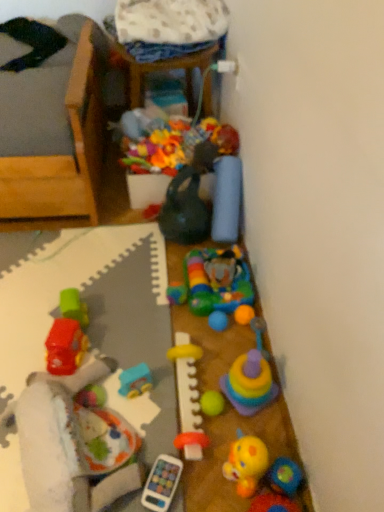
Image resolution: width=384 pixels, height=512 pixels. Describe the element at coordinates (214, 282) in the screenshot. I see `rubberized plastic elephant at center, the 6th toy when ordered from left to right` at that location.

This screenshot has width=384, height=512. Describe the element at coordinates (188, 397) in the screenshot. I see `yellow rubber teething ring at center, the 4th toy from the left` at that location.

Measure the distance between point (48, 432) and camera.

Point (48, 432) and camera are 38.74 inches apart.

The height and width of the screenshot is (512, 384). What do you see at coordinates (246, 463) in the screenshot? I see `rubber duck at center, the fifth toy from the right` at bounding box center [246, 463].

What do you see at coordinates (227, 200) in the screenshot? I see `blue fabric pillow at upper right, arranged as the 4th toy when viewed from the right` at bounding box center [227, 200].

This screenshot has width=384, height=512. Identify the location of green rubber ball at center, which appears as the 5th toy when viewed from the left. (212, 403).

Locate an element on the screen. This screenshot has height=512, width=384. matte green kettle at center, the 3th toy from the left is located at coordinates (185, 210).

Is rubberized plastic elephant at center, the 6th toy when ordered from left to right, to the left or to the right of yellow rubber teething ring at center, positioned as the eighth toy in right-to-left order, in the image?

Clearly, rubberized plastic elephant at center, the 6th toy when ordered from left to right, is on the right of yellow rubber teething ring at center, positioned as the eighth toy in right-to-left order, in the image.

From a real-world perspective, is rubberized plastic elephant at center, marked as the 6th toy in a right-to-left arrangement, on top of yellow rubber teething ring at center, positioned as the eighth toy in right-to-left order?

No, from a real-world perspective, rubberized plastic elephant at center, marked as the 6th toy in a right-to-left arrangement, is not on top of yellow rubber teething ring at center, positioned as the eighth toy in right-to-left order.

Can we say rubberized plastic elephant at center, marked as the 6th toy in a right-to-left arrangement, lies outside yellow rubber teething ring at center, the 4th toy from the left?

Indeed, rubberized plastic elephant at center, marked as the 6th toy in a right-to-left arrangement, is completely outside yellow rubber teething ring at center, the 4th toy from the left.

Considering the sizes of objects rubberized plastic elephant at center, marked as the 6th toy in a right-to-left arrangement, and yellow rubber teething ring at center, positioned as the eighth toy in right-to-left order, in the image provided, who is taller, rubberized plastic elephant at center, marked as the 6th toy in a right-to-left arrangement, or yellow rubber teething ring at center, positioned as the eighth toy in right-to-left order,?

Standing taller between the two is yellow rubber teething ring at center, positioned as the eighth toy in right-to-left order.

Between rubberized plastic elephant at center, marked as the 6th toy in a right-to-left arrangement, and orange rubber ball at center-right, the 10th toy from the left, which one has less height?

Standing shorter between the two is orange rubber ball at center-right, the 10th toy from the left.

Can you confirm if rubberized plastic elephant at center, the 6th toy when ordered from left to right, is bigger than orange rubber ball at center-right, marked as the second toy in a right-to-left arrangement?

Yes.

Considering the relative sizes of rubberized plastic elephant at center, the 6th toy when ordered from left to right, and orange rubber ball at center-right, marked as the second toy in a right-to-left arrangement, in the image provided, is rubberized plastic elephant at center, the 6th toy when ordered from left to right, wider than orange rubber ball at center-right, marked as the second toy in a right-to-left arrangement,?

Yes, rubberized plastic elephant at center, the 6th toy when ordered from left to right, is wider than orange rubber ball at center-right, marked as the second toy in a right-to-left arrangement.

Is wooden toy box at upper center taller or shorter than rubberized plastic baby rattle at lower left, the 11th toy when ordered from right to left?

wooden toy box at upper center is taller than rubberized plastic baby rattle at lower left, the 11th toy when ordered from right to left.

Considering the sizes of objects wooden toy box at upper center and rubberized plastic baby rattle at lower left, arranged as the first toy when viewed from the left, in the image provided, who is wider, wooden toy box at upper center or rubberized plastic baby rattle at lower left, arranged as the first toy when viewed from the left,?

Wider between the two is rubberized plastic baby rattle at lower left, arranged as the first toy when viewed from the left.

Is wooden toy box at upper center touching rubberized plastic baby rattle at lower left, the 11th toy when ordered from right to left?

They are not placed beside each other.

Considering the relative sizes of wooden toy box at upper center and rubberized plastic baby rattle at lower left, the 11th toy when ordered from right to left, in the image provided, is wooden toy box at upper center bigger than rubberized plastic baby rattle at lower left, the 11th toy when ordered from right to left,?

Correct, wooden toy box at upper center is larger in size than rubberized plastic baby rattle at lower left, the 11th toy when ordered from right to left.

How different are the orientations of rubberized plastic elephant at center, the 6th toy when ordered from left to right, and blue fabric pillow at upper right, arranged as the 4th toy when viewed from the right, in degrees?

rubberized plastic elephant at center, the 6th toy when ordered from left to right, and blue fabric pillow at upper right, arranged as the 4th toy when viewed from the right, are facing 5.91 degrees away from each other.

Is rubberized plastic elephant at center, marked as the 6th toy in a right-to-left arrangement, wider than blue fabric pillow at upper right, the 8th toy from the left?

Indeed, rubberized plastic elephant at center, marked as the 6th toy in a right-to-left arrangement, has a greater width compared to blue fabric pillow at upper right, the 8th toy from the left.

Identify the location of toy that is the 2nd one when counting forward from the blue fabric pillow at upper right, the 8th toy from the left. (214, 282).

Does rubberized plastic elephant at center, marked as the 6th toy in a right-to-left arrangement, have a larger size compared to blue fabric pillow at upper right, arranged as the 4th toy when viewed from the right?

Incorrect, rubberized plastic elephant at center, marked as the 6th toy in a right-to-left arrangement, is not larger than blue fabric pillow at upper right, arranged as the 4th toy when viewed from the right.

From a real-world perspective, between orange rubber ball at center-right, the 10th toy from the left, and rubberized plastic elephant at center, marked as the 6th toy in a right-to-left arrangement, who is vertically higher?

orange rubber ball at center-right, the 10th toy from the left, is physically above.

Visually, is orange rubber ball at center-right, marked as the second toy in a right-to-left arrangement, positioned to the left or to the right of rubberized plastic elephant at center, marked as the 6th toy in a right-to-left arrangement?

orange rubber ball at center-right, marked as the second toy in a right-to-left arrangement, is to the right of rubberized plastic elephant at center, marked as the 6th toy in a right-to-left arrangement.

Which object is more forward, orange rubber ball at center-right, marked as the second toy in a right-to-left arrangement, or rubberized plastic elephant at center, the 6th toy when ordered from left to right?

orange rubber ball at center-right, marked as the second toy in a right-to-left arrangement, is closer to the camera.

Can you confirm if orange rubber ball at center-right, marked as the second toy in a right-to-left arrangement, is bigger than rubberized plastic elephant at center, the 6th toy when ordered from left to right?

Incorrect, orange rubber ball at center-right, marked as the second toy in a right-to-left arrangement, is not larger than rubberized plastic elephant at center, the 6th toy when ordered from left to right.

Can you confirm if blue plastic toy car at center, positioned as the tenth toy in right-to-left order, is smaller than orange rubber ball at center-right, the 10th toy from the left?

Actually, blue plastic toy car at center, positioned as the tenth toy in right-to-left order, might be larger than orange rubber ball at center-right, the 10th toy from the left.

Which toy is the 1st one when counting from the front of the orange rubber ball at center-right, the 10th toy from the left? Please provide its 2D coordinates.

[(135, 381)]

Looking at their sizes, would you say blue plastic toy car at center, which is the second toy from left to right, is wider or thinner than orange rubber ball at center-right, the 10th toy from the left?

In the image, blue plastic toy car at center, which is the second toy from left to right, appears to be wider than orange rubber ball at center-right, the 10th toy from the left.

Does rubberized plastic baby rattle at lower left, arranged as the first toy when viewed from the left, have a lesser width compared to yellow rubber teething ring at center, positioned as the eighth toy in right-to-left order?

No, rubberized plastic baby rattle at lower left, arranged as the first toy when viewed from the left, is not thinner than yellow rubber teething ring at center, positioned as the eighth toy in right-to-left order.

Based on the photo, is rubberized plastic baby rattle at lower left, arranged as the first toy when viewed from the left, spatially inside yellow rubber teething ring at center, the 4th toy from the left, or outside of it?

The correct answer is: outside.

Considering the relative sizes of rubberized plastic baby rattle at lower left, arranged as the first toy when viewed from the left, and yellow rubber teething ring at center, positioned as the eighth toy in right-to-left order, in the image provided, is rubberized plastic baby rattle at lower left, arranged as the first toy when viewed from the left, taller than yellow rubber teething ring at center, positioned as the eighth toy in right-to-left order,?

Yes.

The height and width of the screenshot is (512, 384). I want to click on the 5th toy in front when counting from the rubberized plastic elephant at center, marked as the 6th toy in a right-to-left arrangement, so click(188, 397).

Find the location of a particular element. This screenshot has width=384, height=512. toy that is the 4th object to the left of the orange rubber ball at center-right, marked as the second toy in a right-to-left arrangement, starting at the anchor is located at coordinates (214, 282).

Estimate the real-world distances between objects in this image. Which object is closer to orange rubber ball at center-right, the 10th toy from the left, rubberized plastic stacking cups at center-right, which is counted as the 3th toy, starting from the right, or rubberized plastic baby rattle at lower left, the 11th toy when ordered from right to left?

rubberized plastic stacking cups at center-right, which is counted as the 3th toy, starting from the right.

Which object lies nearer to the anchor point yellow rubber teething ring at center, the 4th toy from the left, blue plastic toy car at center, positioned as the tenth toy in right-to-left order, or green rubber ball at center, which appears as the 5th toy when viewed from the left?

green rubber ball at center, which appears as the 5th toy when viewed from the left.

When comparing their distances from rubberized plastic elephant at center, the 6th toy when ordered from left to right, does yellow rubber teething ring at center, the 4th toy from the left, or green rubber ball at center, which appears as the 5th toy when viewed from the left, seem closer?

yellow rubber teething ring at center, the 4th toy from the left, is closer to rubberized plastic elephant at center, the 6th toy when ordered from left to right.

Looking at the image, which one is located further to rubberized yellow duck at lower right, which is the eleventh toy from left to right, rubberized plastic elephant at center, marked as the 6th toy in a right-to-left arrangement, or green rubber ball at center, which is counted as the 7th toy, starting from the right?

rubberized plastic elephant at center, marked as the 6th toy in a right-to-left arrangement, is positioned further to the anchor rubberized yellow duck at lower right, which is the eleventh toy from left to right.

Looking at the image, which one is located further to blue fabric pillow at upper right, the 8th toy from the left, rubber duck at center, which is the 7th toy in left-to-right order, or orange rubber ball at center-right, the 10th toy from the left?

Among the two, rubber duck at center, which is the 7th toy in left-to-right order, is located further to blue fabric pillow at upper right, the 8th toy from the left.

Based on the photo, which object lies further to the anchor point rubberized plastic elephant at center, the 6th toy when ordered from left to right, rubber duck at center, which is the 7th toy in left-to-right order, or blue plastic toy car at center, positioned as the tenth toy in right-to-left order?

Among the two, rubber duck at center, which is the 7th toy in left-to-right order, is located further to rubberized plastic elephant at center, the 6th toy when ordered from left to right.

Based on their spatial positions, is orange rubber ball at center-right, the 10th toy from the left, or rubberized plastic elephant at center, marked as the 6th toy in a right-to-left arrangement, further from matte green kettle at center, marked as the ninth toy in a right-to-left arrangement?

orange rubber ball at center-right, the 10th toy from the left, is positioned further to the anchor matte green kettle at center, marked as the ninth toy in a right-to-left arrangement.

When comparing their distances from yellow rubber teething ring at center, positioned as the eighth toy in right-to-left order, does rubberized yellow duck at lower right, which is the eleventh toy from left to right, or rubberized plastic baby rattle at lower left, arranged as the first toy when viewed from the left, seem closer?

rubberized plastic baby rattle at lower left, arranged as the first toy when viewed from the left, lies closer to yellow rubber teething ring at center, positioned as the eighth toy in right-to-left order, than the other object.

Find the location of a particular element. The height and width of the screenshot is (512, 384). toy between blue fabric pillow at upper right, the 8th toy from the left, and rubberized plastic elephant at center, marked as the 6th toy in a right-to-left arrangement, vertically is located at coordinates (185, 210).

Image resolution: width=384 pixels, height=512 pixels. Identify the location of toy between wooden toy box at upper center and matte green kettle at center, marked as the ninth toy in a right-to-left arrangement, from top to bottom. (227, 200).

Locate an element on the screen. Image resolution: width=384 pixels, height=512 pixels. toy between matte green kettle at center, the 3th toy from the left, and orange rubber ball at center-right, marked as the second toy in a right-to-left arrangement, in the up-down direction is located at coordinates (214, 282).